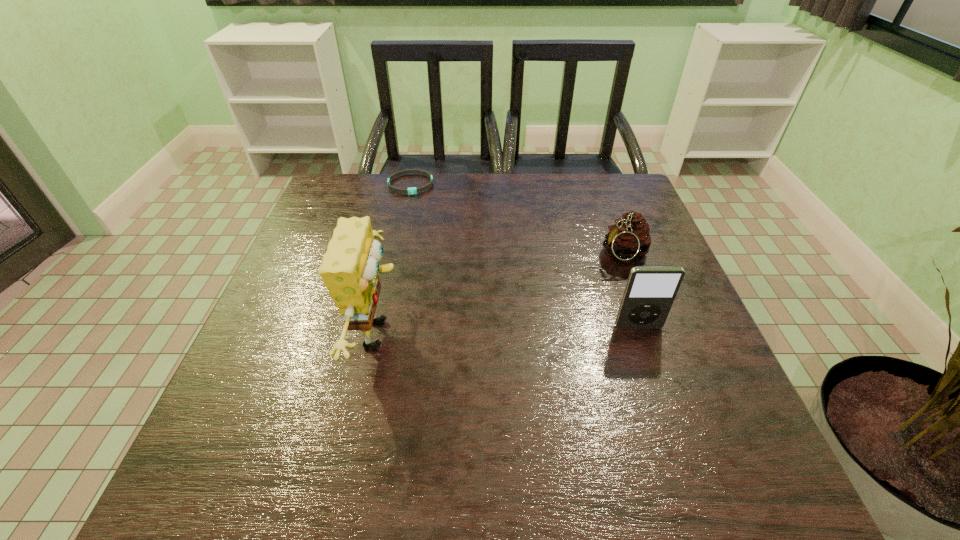
This screenshot has width=960, height=540. I want to click on vacant space at the left edge, so tap(321, 222).

Find the location of a particular element. The width and height of the screenshot is (960, 540). free point at the right edge is located at coordinates pyautogui.click(x=593, y=223).

In order to click on free space at the far left corner of the desktop in this screenshot , I will do `click(318, 217)`.

Where is `free region at the far right corner of the desktop`? This screenshot has width=960, height=540. free region at the far right corner of the desktop is located at coordinates (624, 174).

In order to click on free point between the shortest object and the second shortest object in this screenshot , I will do `click(517, 220)`.

Find the location of a particular element. This screenshot has width=960, height=540. free space between the second shortest object and the shortest object is located at coordinates (517, 220).

Find the location of a particular element. This screenshot has height=540, width=960. unoccupied position between the farthest object and the second shortest object is located at coordinates (517, 220).

The height and width of the screenshot is (540, 960). Identify the location of free space between the third shortest object and the sponge. (509, 330).

The image size is (960, 540). I want to click on empty location between the sponge and the shortest object, so click(x=396, y=259).

Find the location of a particular element. The width and height of the screenshot is (960, 540). free space between the second shortest object and the farthest object is located at coordinates (517, 220).